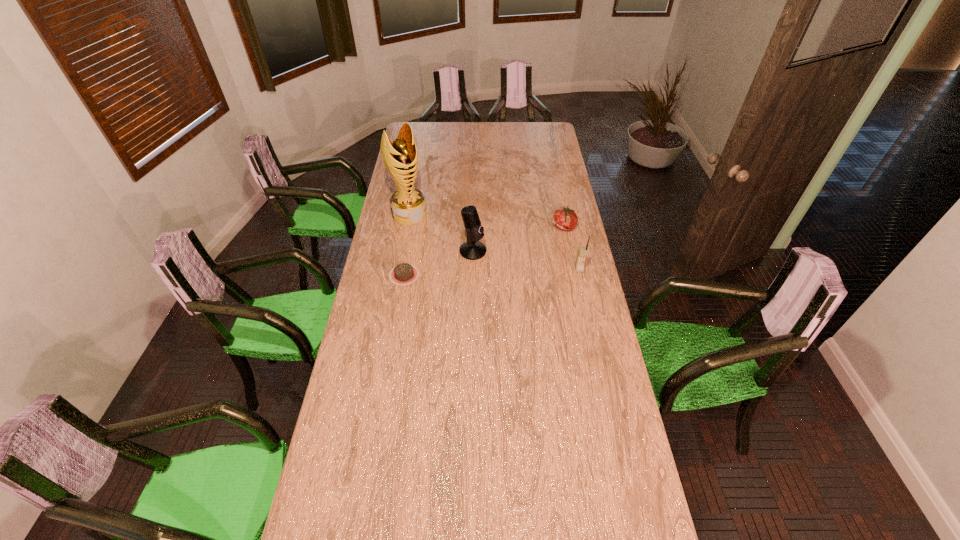
Locate an element on the screen. tomato located at the right edge is located at coordinates (566, 219).

This screenshot has width=960, height=540. In the image, there is a desktop. What are the coordinates of `vacant space at the far edge` in the screenshot? It's located at (470, 124).

Find the location of `free location at the near edge of the desktop`. free location at the near edge of the desktop is located at coordinates (428, 486).

This screenshot has height=540, width=960. Find the location of `free space at the left edge of the desktop`. free space at the left edge of the desktop is located at coordinates (368, 446).

Find the location of a particular element. The height and width of the screenshot is (540, 960). vacant region at the right edge is located at coordinates (578, 277).

In the image, there is a desktop. Identify the location of vacant space at the near right corner. pyautogui.click(x=634, y=473).

Image resolution: width=960 pixels, height=540 pixels. Identify the location of vacant area between the second tallest object and the shortest object. pos(439,263).

The width and height of the screenshot is (960, 540). In order to click on vacant space that's between the tallest object and the fourth tallest object in this screenshot , I will do `click(487, 220)`.

The height and width of the screenshot is (540, 960). Identify the location of empty space that is in between the third shortest object and the chocolate cake. (492, 272).

The image size is (960, 540). In order to click on empty space between the tallest object and the shortest object in this screenshot , I will do 407,245.